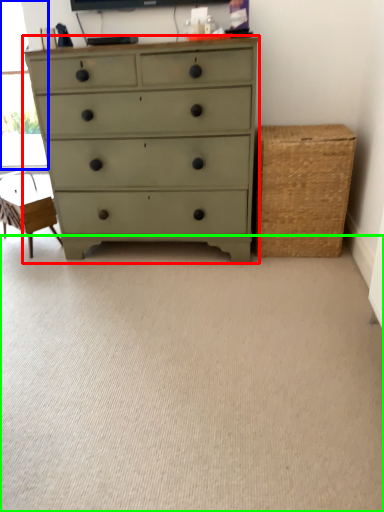
Question: Which is farther away from chest of drawers (highlighted by a red box)? window screen (highlighted by a blue box) or plain (highlighted by a green box)?

Choices:
 (A) window screen
 (B) plain

Answer: (A)